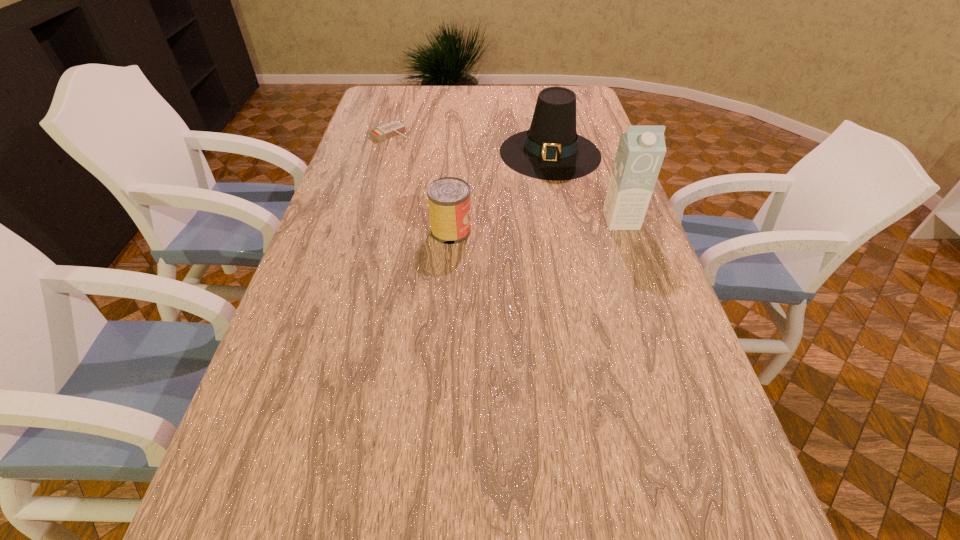
Locate an element on the screen. The image size is (960, 540). vacant space at the right edge of the desktop is located at coordinates (588, 134).

Where is `vacant space at the near right corner of the desktop`? vacant space at the near right corner of the desktop is located at coordinates (668, 473).

Where is `empty space between the tallest object and the second shortest object`? empty space between the tallest object and the second shortest object is located at coordinates coord(536,226).

The image size is (960, 540). I want to click on vacant area that lies between the third tallest object and the hat, so click(500, 192).

Identify the location of vacant space in between the second tallest object and the third tallest object. This screenshot has width=960, height=540. pos(500,192).

Identify the location of vacant space that's between the third shortest object and the second shortest object. (500, 192).

I want to click on vacant space in between the second tallest object and the third object from right to left, so pos(500,192).

You are a GUI agent. You are given a task and a screenshot of the screen. Output one action in this format:
    pyautogui.click(x=<x>, y=<y>)
    Task: Click on the unoccupied area between the leftmost object and the third shortest object
    The image size is (960, 540).
    Given the screenshot: What is the action you would take?
    pyautogui.click(x=469, y=144)

I want to click on vacant area between the can and the carton, so click(536, 226).

I want to click on vacant space that is in between the carton and the can, so click(536, 226).